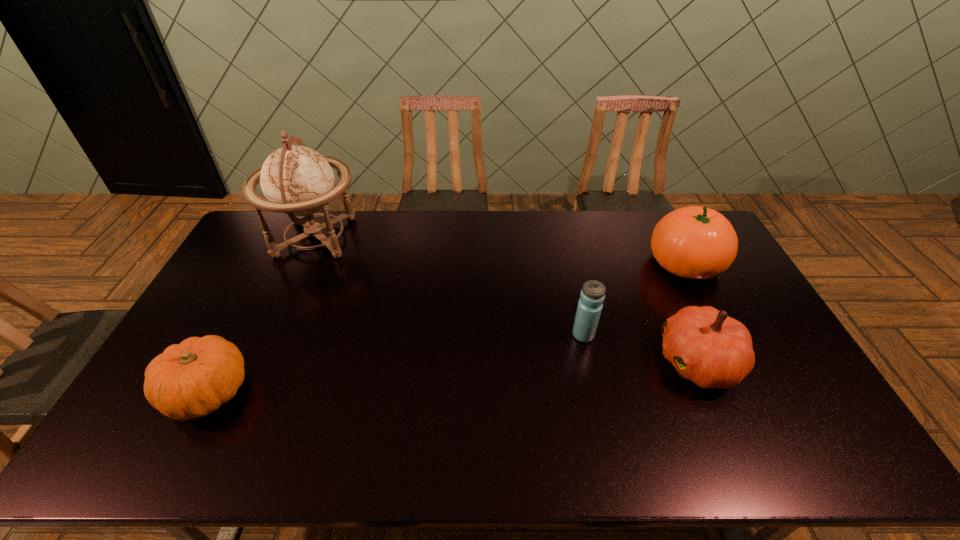
Locate an element on the screen. pumpkin situated at the far edge is located at coordinates (694, 242).

Identify the location of object present at the near edge. The image size is (960, 540). (192, 379).

The width and height of the screenshot is (960, 540). In order to click on globe that is at the left edge in this screenshot , I will do `click(296, 180)`.

Locate an element on the screen. This screenshot has width=960, height=540. pumpkin situated at the left edge is located at coordinates (192, 379).

At what (x,y) coordinates should I click in order to perform the action: click on object located at the far left corner. Please return your answer as a coordinate pair (x, y). The width and height of the screenshot is (960, 540). Looking at the image, I should click on (296, 180).

This screenshot has width=960, height=540. I want to click on object that is positioned at the near left corner, so click(x=192, y=379).

Identify the location of object that is at the far right corner. pos(694,242).

The width and height of the screenshot is (960, 540). In order to click on vacant space at the far edge of the desktop in this screenshot , I will do point(495,216).

This screenshot has height=540, width=960. In the image, there is a desktop. In order to click on free space at the near edge in this screenshot , I will do `click(776, 455)`.

In the image, there is a desktop. At what (x,y) coordinates should I click in order to perform the action: click on free space at the left edge. Please return your answer as a coordinate pair (x, y). The image size is (960, 540). Looking at the image, I should click on (238, 328).